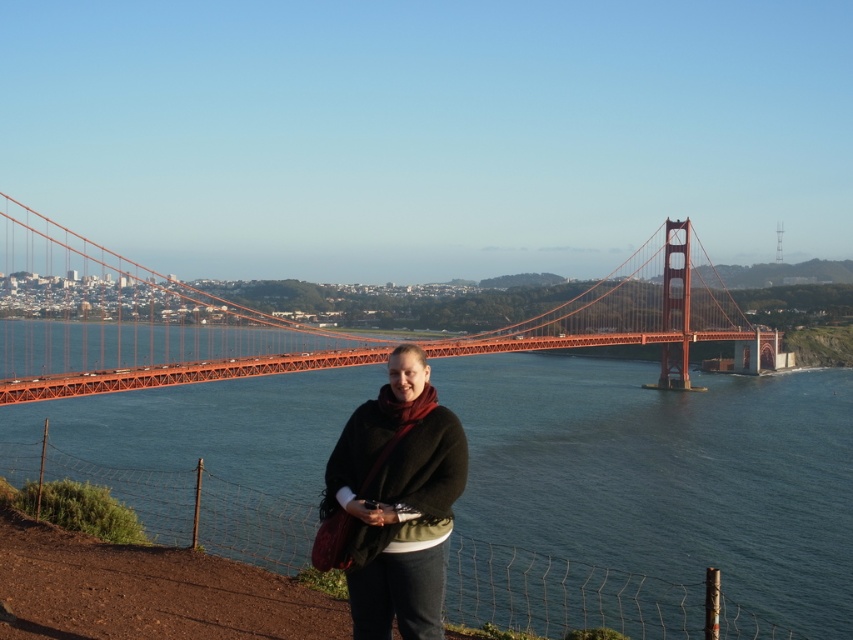
Question: Which point is farther to the camera?

Choices:
 (A) dark brown woolen shawl at center
 (B) orange painted steel golden gate bridge at center

Answer: (B)

Question: Can you confirm if glossy water at center is positioned to the right of dark brown woolen shawl at center?

Choices:
 (A) yes
 (B) no

Answer: (A)

Question: Which object is positioned farthest from the dark brown woolen shawl at center?

Choices:
 (A) orange painted steel golden gate bridge at center
 (B) glossy water at center

Answer: (A)

Question: Does glossy water at center have a smaller size compared to orange painted steel golden gate bridge at center?

Choices:
 (A) no
 (B) yes

Answer: (B)

Question: Based on their relative distances, which object is nearer to the orange painted steel golden gate bridge at center?

Choices:
 (A) dark brown woolen shawl at center
 (B) glossy water at center

Answer: (B)

Question: Is the position of glossy water at center more distant than that of dark brown woolen shawl at center?

Choices:
 (A) no
 (B) yes

Answer: (B)